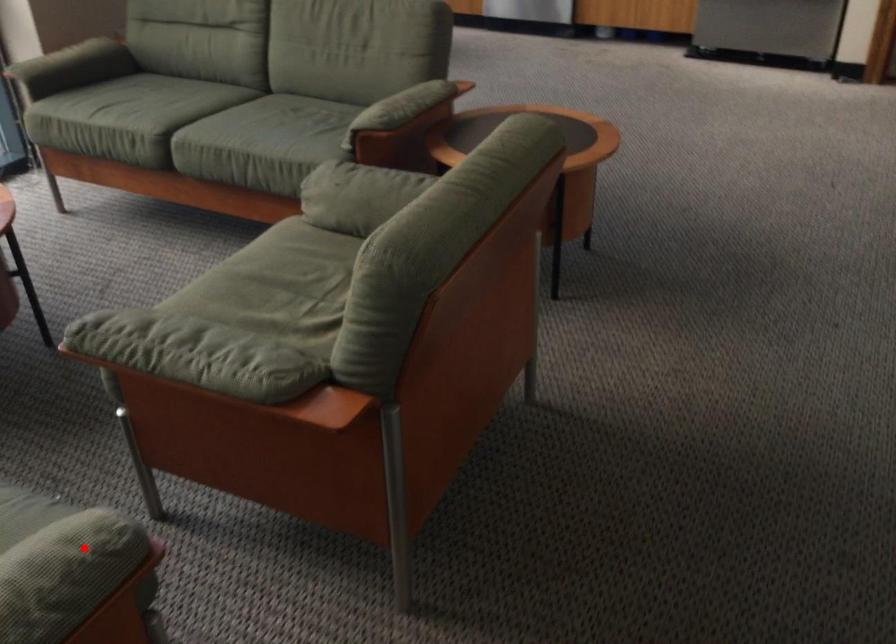
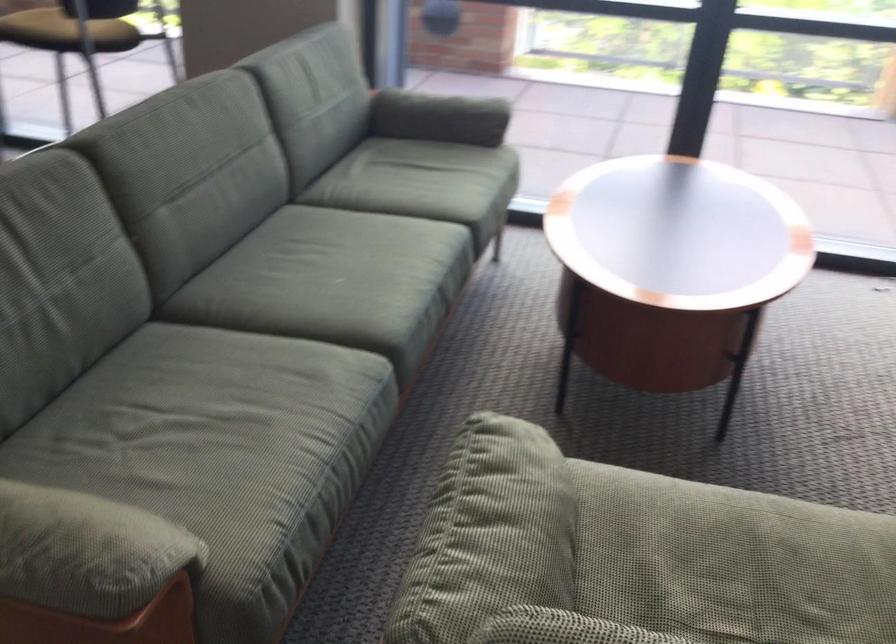
In the second image, find the point that corresponds to the highlighted location in the first image.

(82, 552)